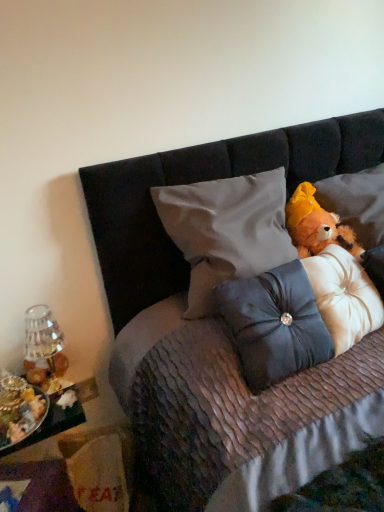
Question: In terms of height, does metallic silver tray at lower left look taller or shorter compared to satin gray pillow at center, positioned as the 1th pillow in left-to-right order?

Choices:
 (A) tall
 (B) short

Answer: (B)

Question: From a real-world perspective, relative to satin gray pillow at center, positioned as the 1th pillow in left-to-right order, is metallic silver tray at lower left vertically above or below?

Choices:
 (A) above
 (B) below

Answer: (B)

Question: Estimate the real-world distances between objects in this image. Which object is farther from the satin/textured pillow at right, which is counted as the first pillow, starting from the right?

Choices:
 (A) transparent glass vase at left
 (B) fluffy orange teddy bear at upper right
 (C) metallic silver tray at lower left
 (D) satin dark blue pillow at center, the second pillow from the right
 (E) satin gray pillow at center, acting as the 3th pillow starting from the right

Answer: (C)

Question: Which of these objects is positioned farthest from the metallic silver tray at lower left?

Choices:
 (A) transparent glass vase at left
 (B) satin dark blue pillow at center, the 2th pillow viewed from the left
 (C) fluffy orange teddy bear at upper right
 (D) satin/textured pillow at right, which is counted as the first pillow, starting from the right
 (E) satin gray pillow at center, acting as the 3th pillow starting from the right

Answer: (C)